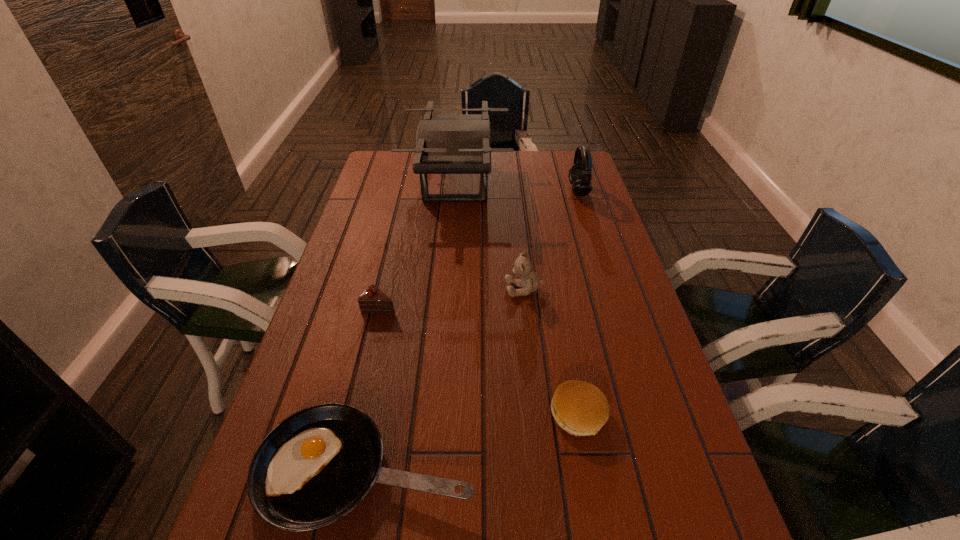
Where is `blank region between the frying pan and the chocolate cake`? This screenshot has height=540, width=960. blank region between the frying pan and the chocolate cake is located at coordinates (x=373, y=388).

This screenshot has width=960, height=540. In order to click on empty location between the headset and the chocolate cake in this screenshot , I will do `click(479, 248)`.

Locate an element on the screen. The height and width of the screenshot is (540, 960). unoccupied position between the chocolate cake and the drone is located at coordinates (419, 244).

Locate an element on the screen. vacant space that's between the tallest object and the chocolate cake is located at coordinates (419, 244).

I want to click on free spot between the headset and the patty, so click(x=578, y=302).

You are a GUI agent. You are given a task and a screenshot of the screen. Output one action in this format:
    pyautogui.click(x=<x>, y=<y>)
    Task: Click on the empty location between the frying pan and the patty
    This screenshot has width=960, height=540.
    Given the screenshot: What is the action you would take?
    pyautogui.click(x=472, y=442)

The width and height of the screenshot is (960, 540). What are the coordinates of `free space between the chocolate cake and the frying pan` in the screenshot? It's located at (373, 388).

The width and height of the screenshot is (960, 540). I want to click on free space that is in between the tallest object and the frying pan, so click(412, 326).

You are a GUI agent. You are given a task and a screenshot of the screen. Output one action in this format:
    pyautogui.click(x=<x>, y=<y>)
    Task: Click on the free space between the frying pan and the tallest object
    
    Given the screenshot: What is the action you would take?
    pyautogui.click(x=412, y=326)

Identify the location of empty space that is in between the teddy bear and the patty. (551, 352).